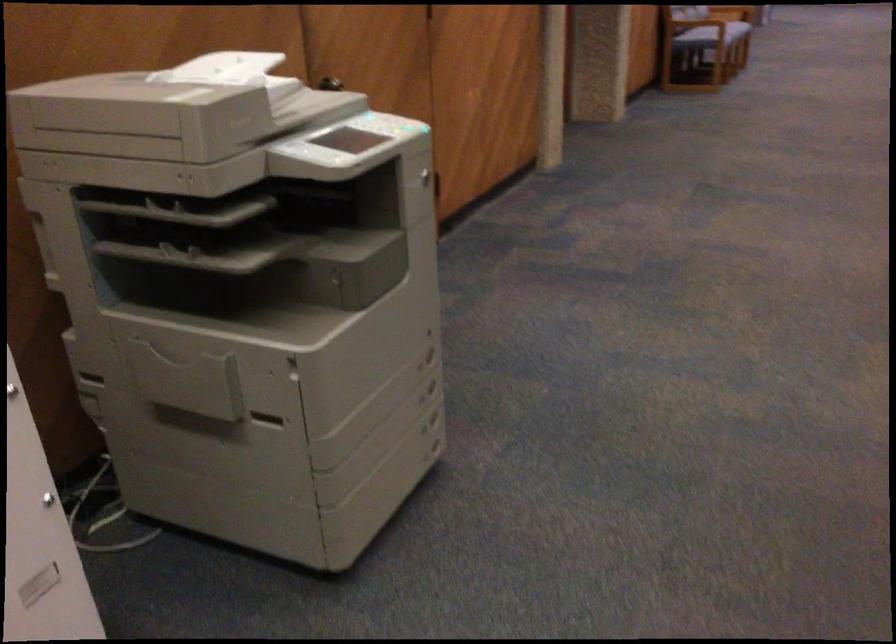
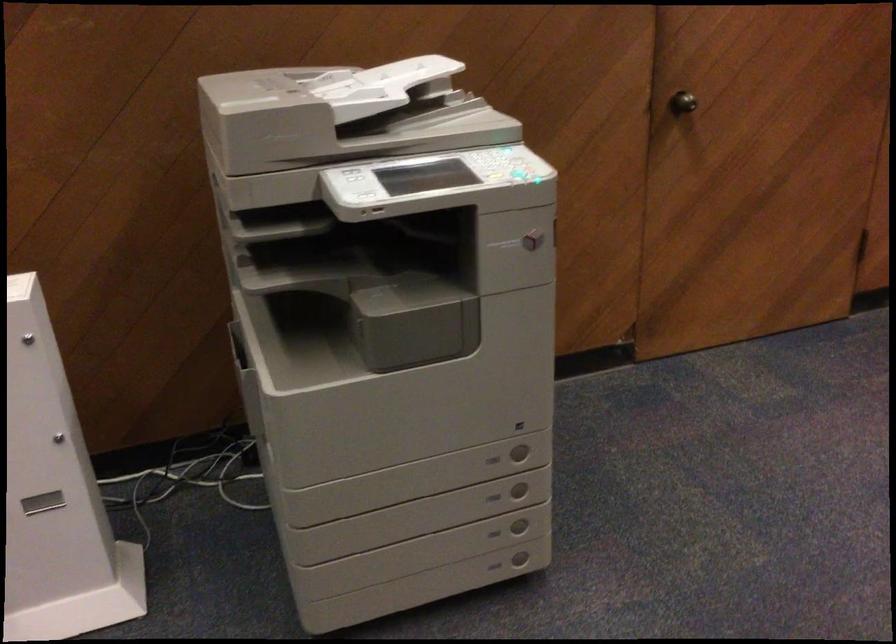
Locate, in the second image, the point that corresponds to (438,422) in the first image.

(519, 527)